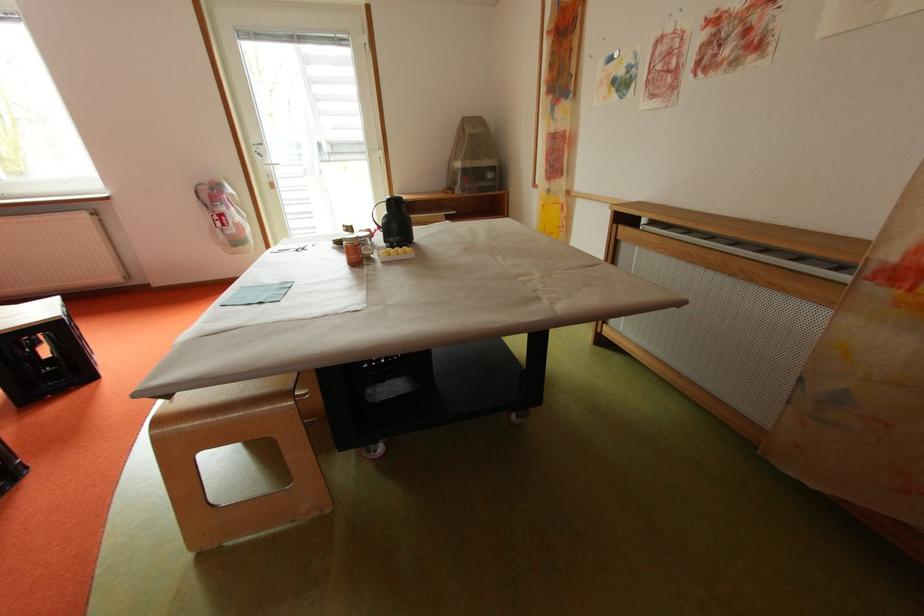
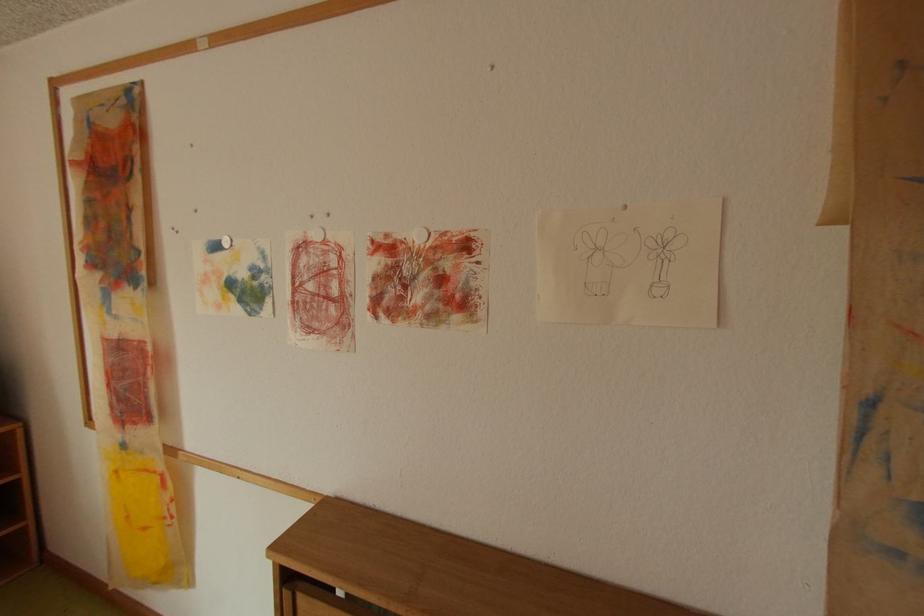
Where in the second image is the point corresponding to [619,60] from the first image?

(225, 246)